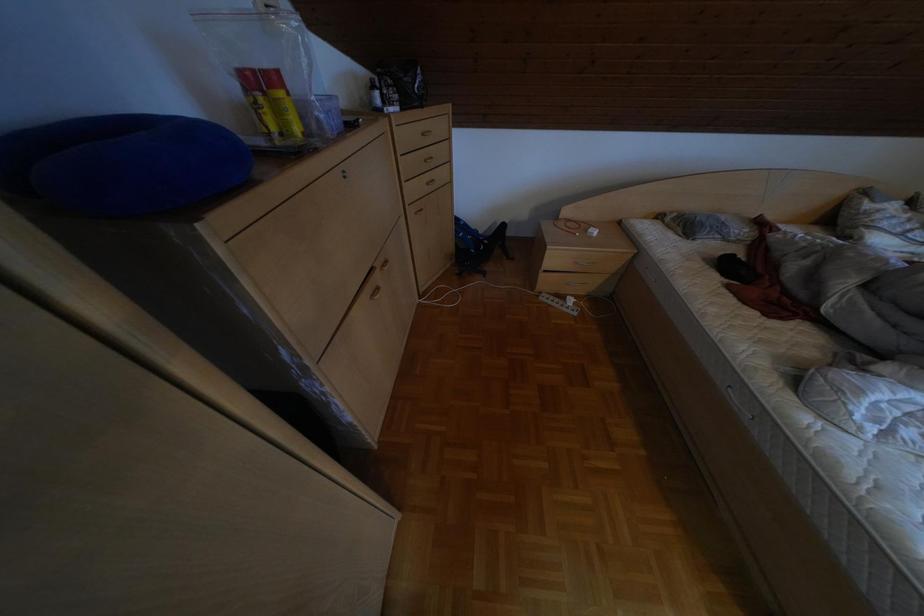
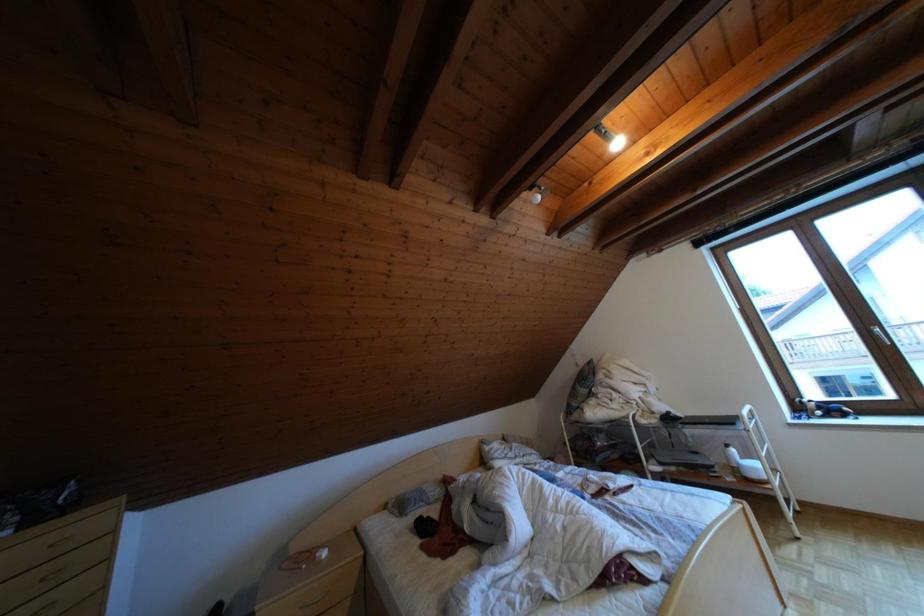
Based on the continuous images, in which direction is the camera rotating?

The camera's rotation is toward right-up.